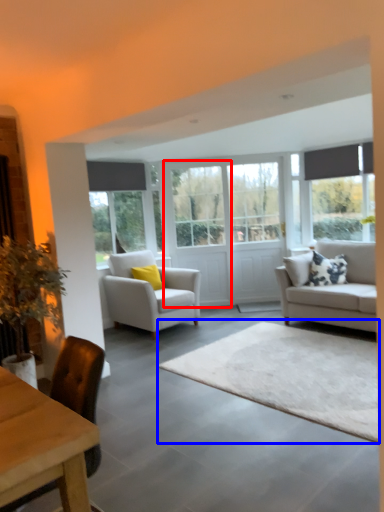
Question: Among these objects, which one is farthest to the camera, glass door (highlighted by a red box) or plain (highlighted by a blue box)?

Choices:
 (A) glass door
 (B) plain

Answer: (A)